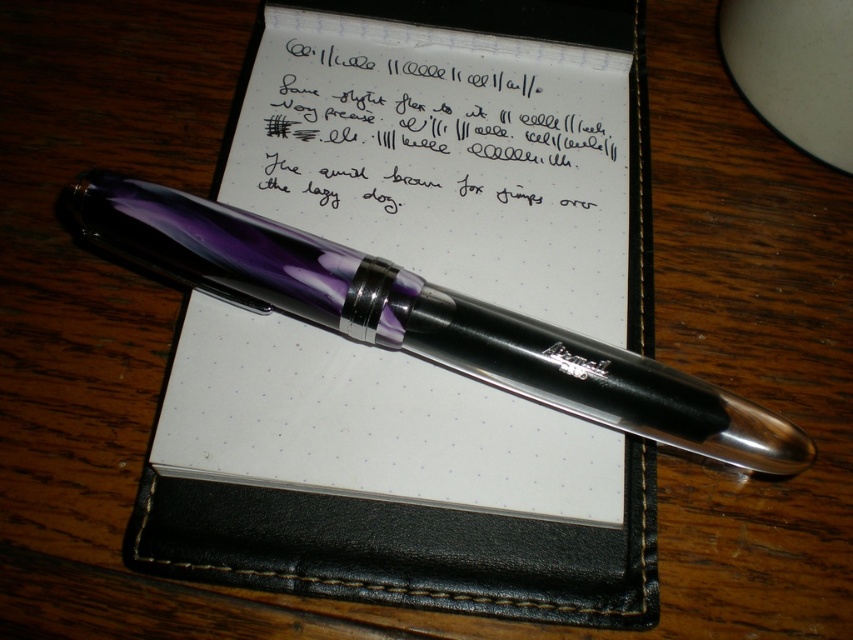
Question: Based on their relative distances, which object is farther from the black leather notebook at center?

Choices:
 (A) black paper at center
 (B) translucent purple pen at center

Answer: (B)

Question: Which of the following is the farthest from the observer?

Choices:
 (A) (442, 152)
 (B) (332, 108)
 (C) (595, 371)

Answer: (A)

Question: Is black leather notebook at center wider than translucent purple pen at center?

Choices:
 (A) no
 (B) yes

Answer: (A)

Question: Does black leather notebook at center appear on the right side of black paper at center?

Choices:
 (A) yes
 (B) no

Answer: (B)

Question: Can you confirm if black leather notebook at center is thinner than black paper at center?

Choices:
 (A) yes
 (B) no

Answer: (B)

Question: Which object is farther from the camera taking this photo?

Choices:
 (A) black paper at center
 (B) translucent purple pen at center

Answer: (A)